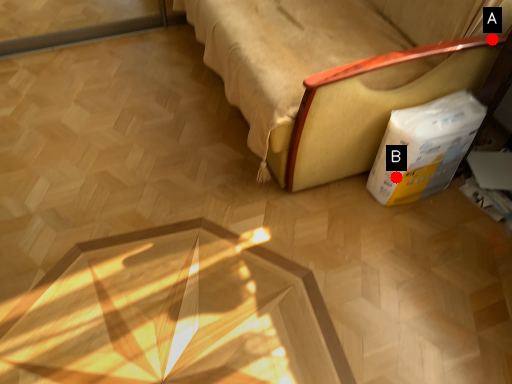
Question: Two points are circled on the image, labeled by A and B beside each circle. Which of the following is the closest to the observer?

Choices:
 (A) A is closer
 (B) B is closer

Answer: (A)